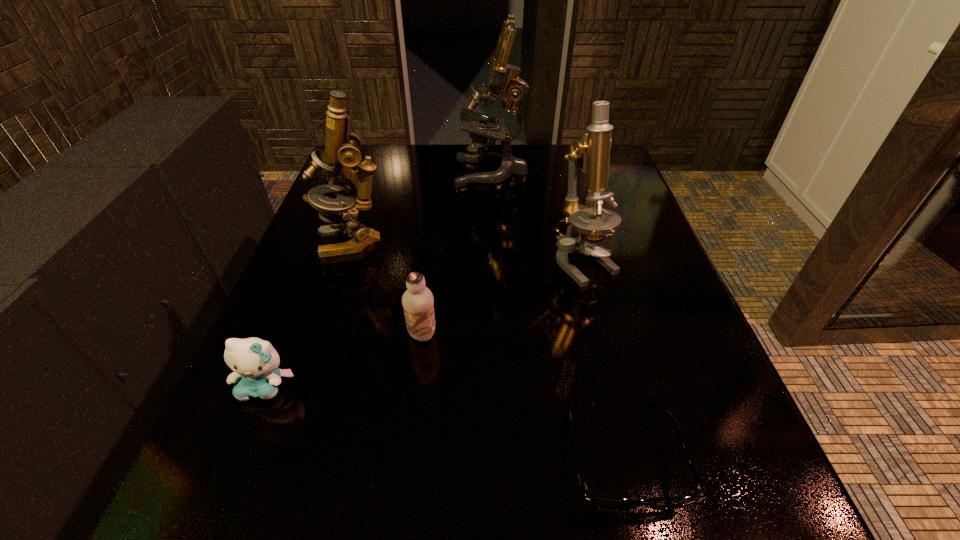
I want to click on empty space between the farthest microscope and the leftmost microscope, so click(x=422, y=206).

Find the location of `free area in between the leftmost microscope and the rightmost microscope`. free area in between the leftmost microscope and the rightmost microscope is located at coordinates (468, 252).

At what (x,y) coordinates should I click in order to perform the action: click on unoccupied area between the second microscope from left to right and the rightmost microscope. Please return your answer as a coordinate pair (x, y). Looking at the image, I should click on (538, 217).

I want to click on free spot between the kitten and the farthest object, so click(x=378, y=279).

Find the location of `free space that is in between the leftmost microscope and the rightmost microscope`. free space that is in between the leftmost microscope and the rightmost microscope is located at coordinates [468, 252].

In order to click on vacant point located between the chocolate milk and the second microscope from left to right in this screenshot , I will do `click(457, 253)`.

Find the location of a particular element. The height and width of the screenshot is (540, 960). free spot between the leftmost microscope and the fourth object from right to left is located at coordinates point(388,288).

Find the location of a particular element. The width and height of the screenshot is (960, 540). free spot between the rightmost microscope and the leftmost microscope is located at coordinates (468, 252).

Select which object appears as the closest to the fourth farthest object. Please provide its 2D coordinates. Your answer should be formatted as a tuple, i.e. [(x, y)], where the tuple contains the x and y coordinates of a point satisfying the conditions above.

[(255, 362)]

Select which object is the fifth closest to the spectacles. Please provide its 2D coordinates. Your answer should be formatted as a tuple, i.e. [(x, y)], where the tuple contains the x and y coordinates of a point satisfying the conditions above.

[(502, 77)]